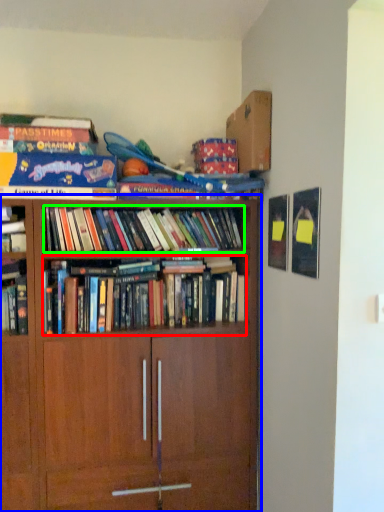
Question: Considering the real-world distances, which object is farthest from book (highlighted by a red box)? bookcase (highlighted by a blue box) or book (highlighted by a green box)?

Choices:
 (A) bookcase
 (B) book

Answer: (A)